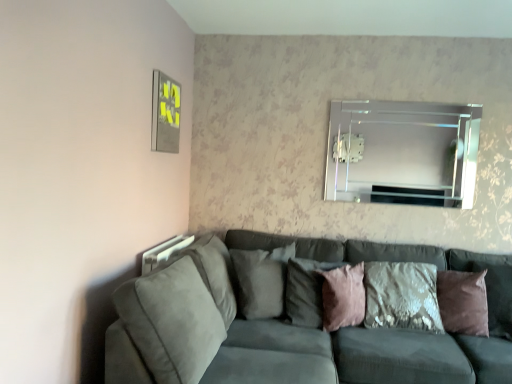
Question: From the image's perspective, relative to clear glass mirror at upper center, is pink velvet pillow at center, the second pillow in the left-to-right sequence, above or below?

Choices:
 (A) above
 (B) below

Answer: (B)

Question: From a real-world perspective, relative to clear glass mirror at upper center, is pink velvet pillow at center, the 3th pillow viewed from the right, vertically above or below?

Choices:
 (A) below
 (B) above

Answer: (A)

Question: Considering the real-world distances, which object is closest to the suede gray pillow at center, the fourth pillow positioned from the right?

Choices:
 (A) clear glass mirror at upper center
 (B) pink velvet pillow at center, which appears as the second pillow when viewed from the right
 (C) brown velvet pillow at right, which is the 1th pillow in right-to-left order
 (D) suede gray couch at lower left
 (E) pink velvet pillow at center, the second pillow in the left-to-right sequence

Answer: (E)

Question: Which is nearer to the suede gray pillow at center, the fourth pillow positioned from the right?

Choices:
 (A) brown velvet pillow at right, which is the 1th pillow in right-to-left order
 (B) clear glass mirror at upper center
 (C) suede gray couch at lower left
 (D) pink velvet pillow at center, the second pillow in the left-to-right sequence
 (E) pink velvet pillow at center, marked as the third pillow in a left-to-right arrangement

Answer: (D)